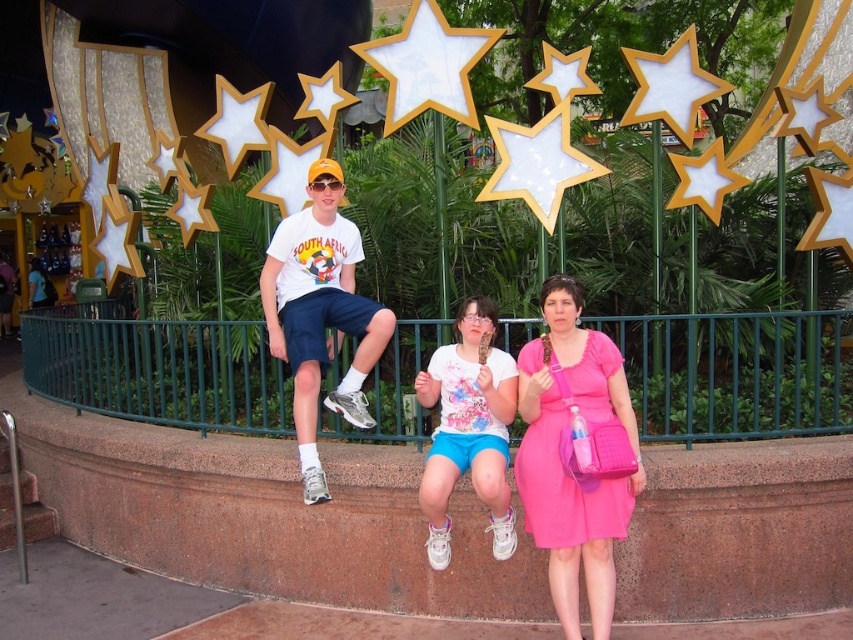
Image resolution: width=853 pixels, height=640 pixels. Describe the element at coordinates (576, 454) in the screenshot. I see `pink satin dress at center` at that location.

In order to click on pink satin dress at center in this screenshot , I will do `click(576, 454)`.

Who is more forward, (x=821, y=534) or (x=537, y=348)?

Point (x=537, y=348) is in front.

Is pink fabric ledge at center above pink satin dress at center?

No.

Is point (109, 436) positioned after point (604, 548)?

Yes, it is behind point (604, 548).

This screenshot has height=640, width=853. In order to click on pink fabric ledge at center in this screenshot , I will do `click(267, 515)`.

Does green metal fence at center appear on the right side of pink satin dress at center?

In fact, green metal fence at center is to the left of pink satin dress at center.

Which is below, green metal fence at center or pink satin dress at center?

pink satin dress at center is below.

Who is more forward, [846,417] or [546,353]?

Point [546,353] is in front.

Locate an element on the screen. The image size is (853, 640). green metal fence at center is located at coordinates (735, 372).